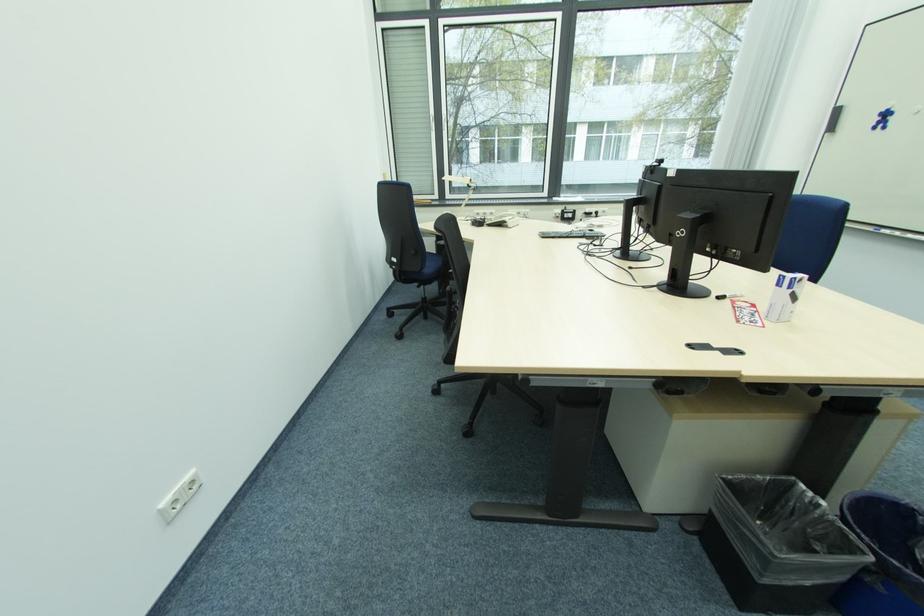
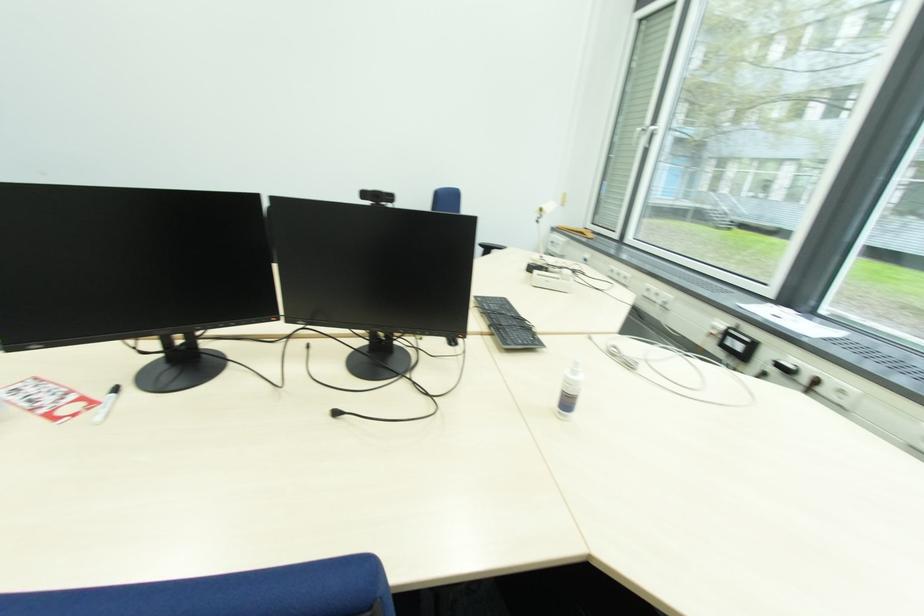
Where in the second image is the point corresponding to (568,213) from the first image?

(734, 333)